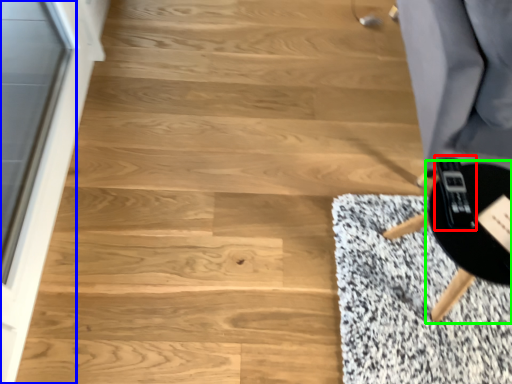
Question: Which is nearer to the game controller (highlighted by a red box)? screen door (highlighted by a blue box) or round table (highlighted by a green box).

Choices:
 (A) screen door
 (B) round table

Answer: (B)